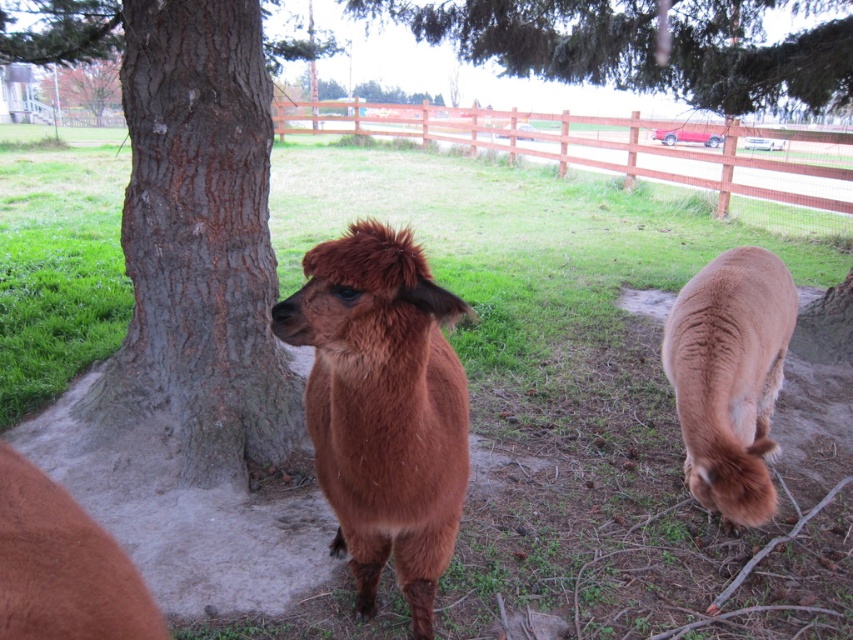
Question: Is gray rough bark tree at center bigger than brown fluffy alpaca at center?

Choices:
 (A) no
 (B) yes

Answer: (B)

Question: Which of the following is the closest to the observer?

Choices:
 (A) gray rough bark tree at center
 (B) brown fluffy alpaca at center

Answer: (B)

Question: Does gray rough bark tree at center come behind brown fluffy alpaca at center?

Choices:
 (A) yes
 (B) no

Answer: (A)

Question: Based on their relative distances, which object is farther from the brown fluffy alpaca at center?

Choices:
 (A) brown wooden fence at upper center
 (B) green leafy tree at upper center

Answer: (A)

Question: Which of the following is the farthest from the observer?

Choices:
 (A) (764, 342)
 (B) (828, 189)

Answer: (B)

Question: Does brown fluffy alpaca at center have a smaller size compared to brown woolen camel at lower right?

Choices:
 (A) no
 (B) yes

Answer: (B)